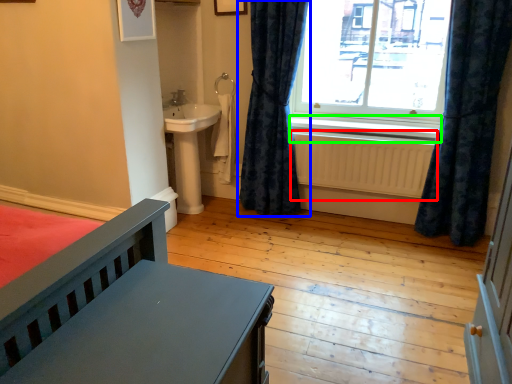
Question: Which is farther away from radiator (highlighted by a red box)? curtain (highlighted by a blue box) or window sill (highlighted by a green box)?

Choices:
 (A) curtain
 (B) window sill

Answer: (A)